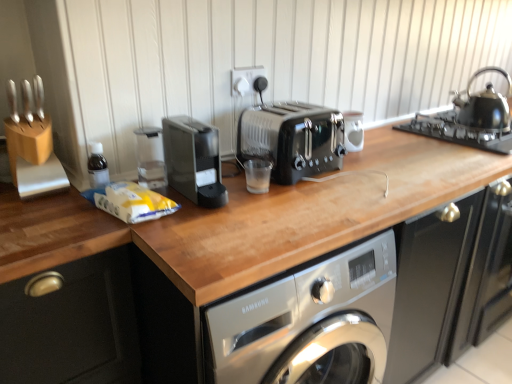
Image resolution: width=512 pixels, height=384 pixels. What are the coordinates of `vacant region to the right of black plastic coffee machine at center` in the screenshot? It's located at (269, 202).